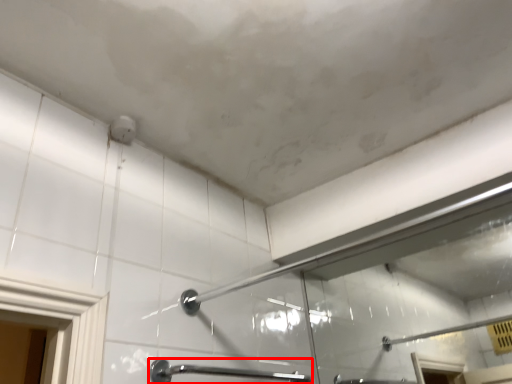
Question: Where is door handle (annotated by the red box) located in relation to shower in the image?

Choices:
 (A) left
 (B) right

Answer: (A)